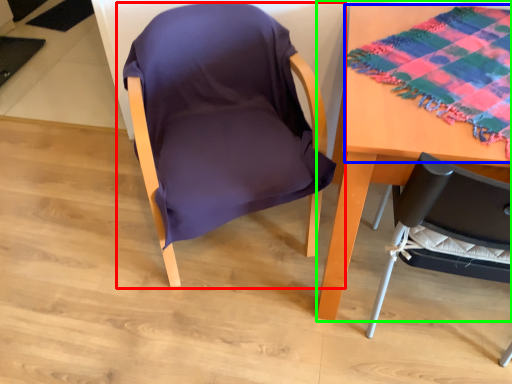
Question: Which object is the closest to the chair (highlighted by a red box)? Choose among these: blanket (highlighted by a blue box) or table (highlighted by a green box).

Choices:
 (A) blanket
 (B) table

Answer: (B)